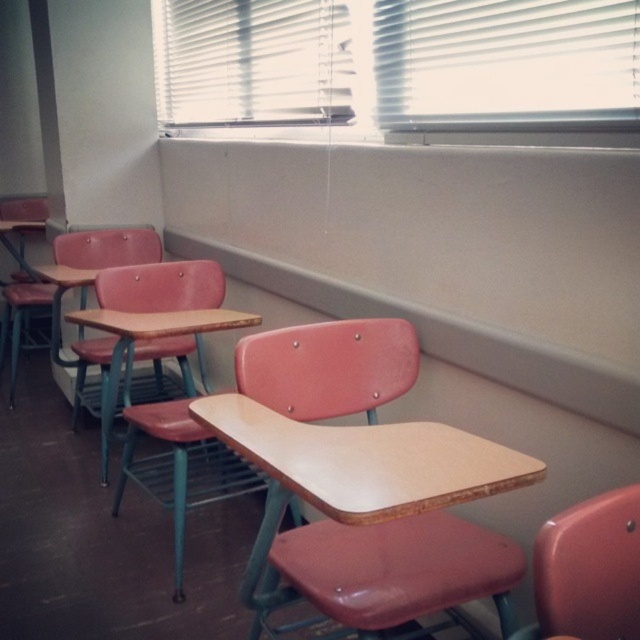
Question: Is white blinds at upper center below matte plastic chair at center?

Choices:
 (A) no
 (B) yes

Answer: (A)

Question: Is matte pink chair at lower right thinner than matte plastic chair at center?

Choices:
 (A) no
 (B) yes

Answer: (B)

Question: Is the position of matte pink chair at lower right more distant than that of matte plastic chair at center?

Choices:
 (A) yes
 (B) no

Answer: (B)

Question: Which is nearer to the matte wood desk at center?

Choices:
 (A) white blinds at upper center
 (B) matte plastic chair at center

Answer: (A)

Question: Which object is the closest to the white blinds at upper center?

Choices:
 (A) matte pink chair at lower right
 (B) matte wood desk at center
 (C) matte plastic chair at center

Answer: (C)

Question: Based on their relative distances, which object is nearer to the matte plastic chair at center?

Choices:
 (A) matte wood desk at center
 (B) white blinds at upper center
 (C) matte pink chair at lower right

Answer: (B)